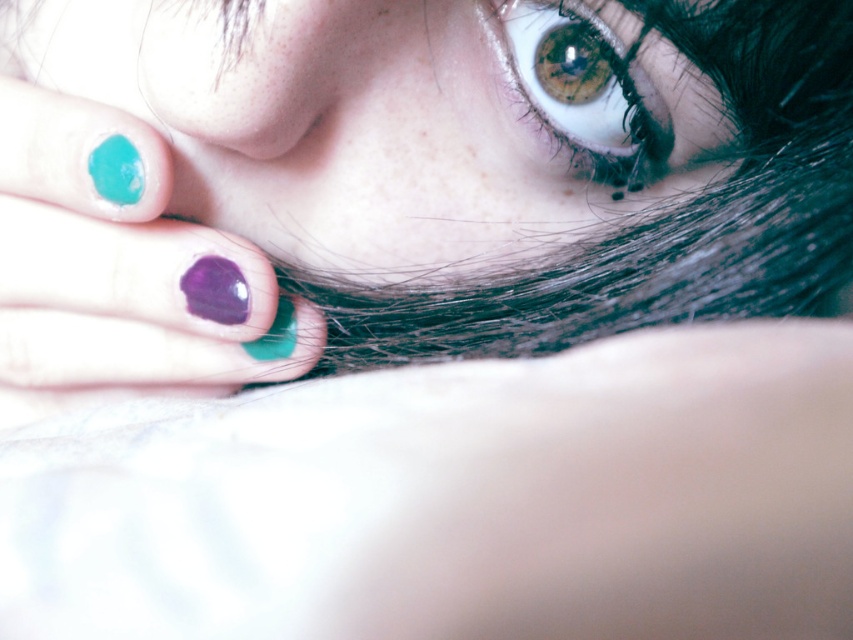
Is teal glossy nail polish at lower left below purple glossy nail polish at center?

Yes, teal glossy nail polish at lower left is below purple glossy nail polish at center.

Is teal glossy nail polish at lower left taller than purple glossy nail polish at center?

Yes, teal glossy nail polish at lower left is taller than purple glossy nail polish at center.

Identify the location of teal glossy nail polish at lower left. The width and height of the screenshot is (853, 640). (120, 266).

What are the coordinates of `teal glossy nail polish at lower left` in the screenshot? It's located at (120, 266).

Consider the image. Can you confirm if teal glossy nails at upper left is positioned to the right of brown matte eye at upper center?

In fact, teal glossy nails at upper left is to the left of brown matte eye at upper center.

The image size is (853, 640). What do you see at coordinates (407, 179) in the screenshot?
I see `teal glossy nails at upper left` at bounding box center [407, 179].

Locate an element on the screen. teal glossy nails at upper left is located at coordinates (407, 179).

Image resolution: width=853 pixels, height=640 pixels. What do you see at coordinates (120, 266) in the screenshot?
I see `teal glossy nail polish at lower left` at bounding box center [120, 266].

Which is below, teal glossy nail polish at lower left or brown matte eye at upper center?

Positioned lower is teal glossy nail polish at lower left.

Which is in front, point (22, 381) or point (633, 100)?

Point (633, 100) is more forward.

The width and height of the screenshot is (853, 640). Find the location of `teal glossy nail polish at lower left`. teal glossy nail polish at lower left is located at coordinates (120, 266).